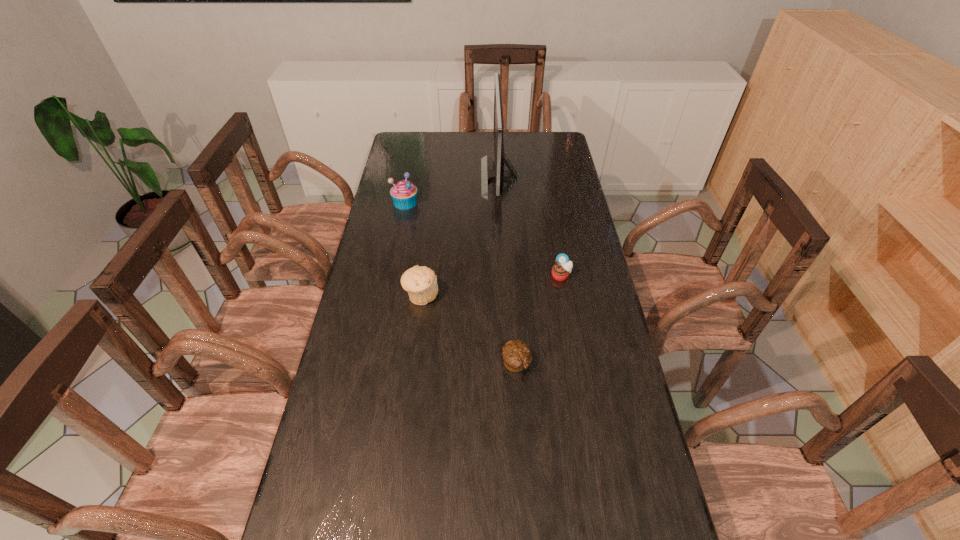
Locate an element on the screen. The width and height of the screenshot is (960, 540). free space that satisfies the following two spatial constraints: 1. on the front side of the third farthest muffin; 2. on the right side of the farthest muffin is located at coordinates (387, 295).